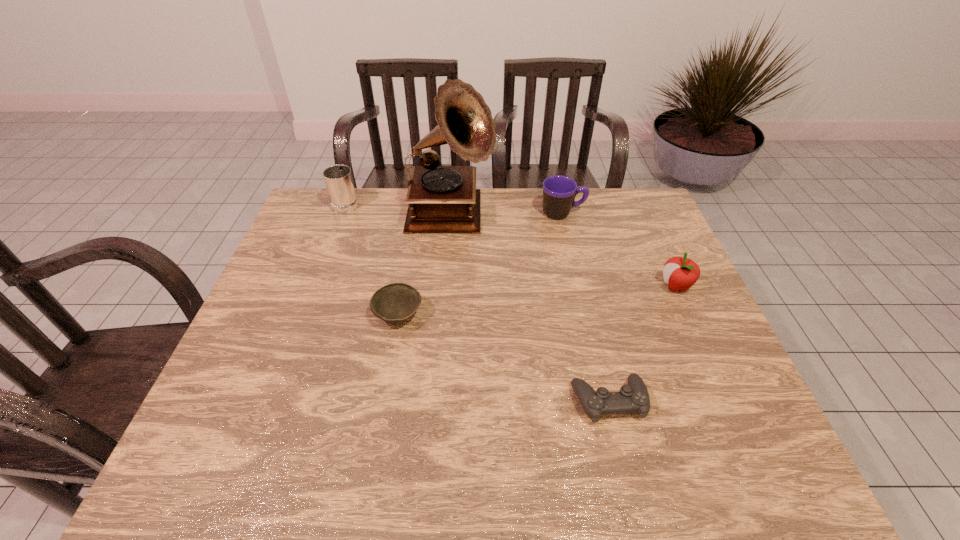
What are the coordinates of `record player` in the screenshot? It's located at (441, 198).

Locate an element on the screen. the leftmost object is located at coordinates (339, 182).

The height and width of the screenshot is (540, 960). I want to click on the shorter mug, so click(559, 192).

You are a GUI agent. You are given a task and a screenshot of the screen. Output one action in this format:
    pyautogui.click(x=<x>, y=<y>)
    Task: Click on the rightmost object
    The image size is (960, 540).
    Given the screenshot: What is the action you would take?
    pyautogui.click(x=680, y=273)

Identify the location of bowl. This screenshot has height=540, width=960. (397, 302).

Where is `the nearest object`? Image resolution: width=960 pixels, height=540 pixels. the nearest object is located at coordinates (634, 397).

This screenshot has width=960, height=540. I want to click on blank space located on the horn of the tallest object, so click(582, 217).

This screenshot has height=540, width=960. I want to click on vacant space located 0.130m with the handle on the side of the right mug, so click(x=624, y=213).

Locate an element on the screen. The height and width of the screenshot is (540, 960). vacant area located 0.340m on the left of the rightmost object is located at coordinates (537, 286).

Image resolution: width=960 pixels, height=540 pixels. Find the location of `vacant space situated on the left of the bowl`. vacant space situated on the left of the bowl is located at coordinates (354, 315).